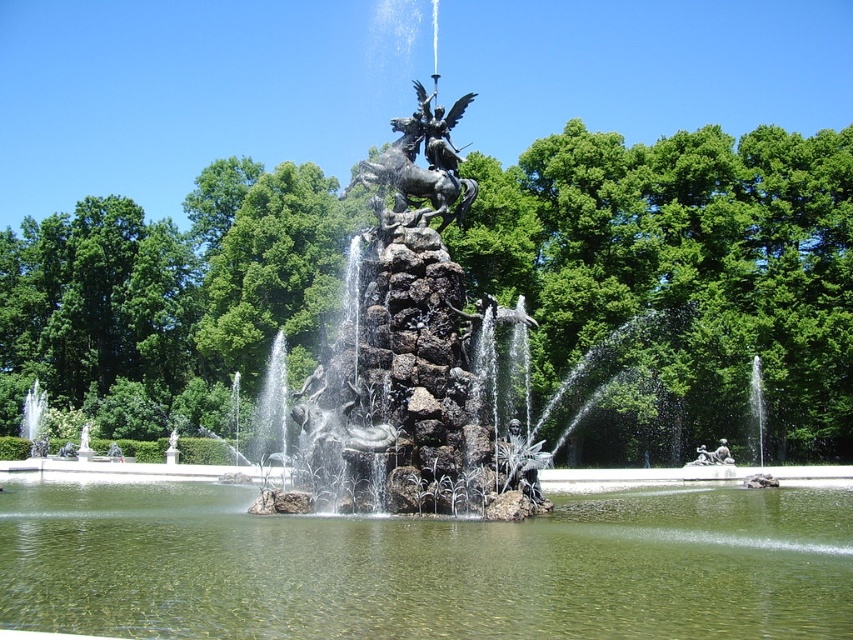
Question: Does green stone lake at center appear on the left side of polished bronze statue at upper center?

Choices:
 (A) no
 (B) yes

Answer: (A)

Question: Does green stone lake at center appear over polished bronze statue at upper center?

Choices:
 (A) yes
 (B) no

Answer: (B)

Question: Does green stone lake at center have a larger size compared to polished bronze statue at upper center?

Choices:
 (A) yes
 (B) no

Answer: (A)

Question: Among these points, which one is nearest to the camera?

Choices:
 (A) pyautogui.click(x=503, y=625)
 (B) pyautogui.click(x=363, y=179)

Answer: (A)